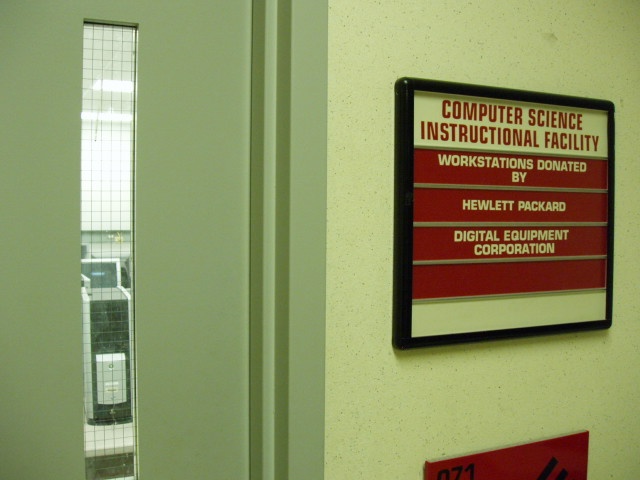
You are a GUI agent. You are given a task and a screenshot of the screen. Output one action in this format:
    pyautogui.click(x=<x>, y=<y>)
    Task: Click on the wall
    Image resolution: width=640 pixels, height=480 pixels.
    Given the screenshot: What is the action you would take?
    pyautogui.click(x=461, y=39)